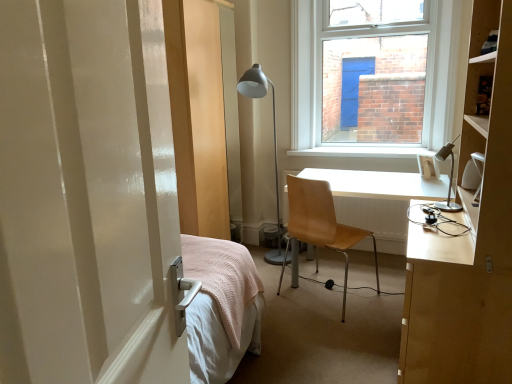
Locate an element on the screen. The image size is (512, 384). free space to the left of white plastic picture frame at upper right is located at coordinates (393, 182).